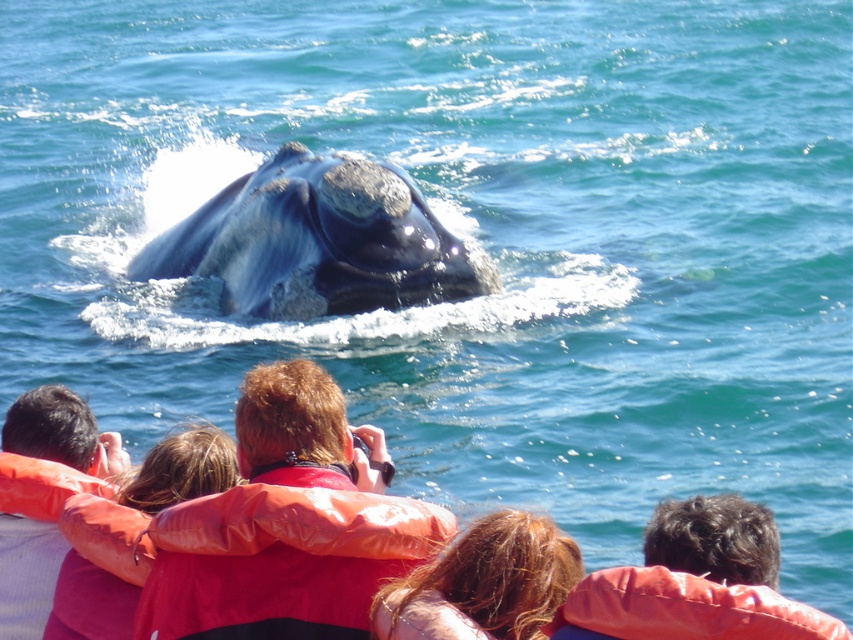
Is orange life vest at lower left thinner than orange life jacket at lower left?

No, orange life vest at lower left is not thinner than orange life jacket at lower left.

Is orange life vest at lower left behind orange life jacket at lower left?

Yes, orange life vest at lower left is behind orange life jacket at lower left.

The width and height of the screenshot is (853, 640). In order to click on orange life vest at lower left in this screenshot , I will do `click(44, 497)`.

Does red life vest at center have a lesser height compared to orange life jacket at lower left?

No.

Who is positioned more to the right, red life vest at center or orange life jacket at lower left?

orange life jacket at lower left is more to the right.

Where is `red life vest at center`? This screenshot has height=640, width=853. red life vest at center is located at coordinates (183, 468).

In the scene shown: Is gray matte whale at center wider than red life vest at center?

Yes.

Between gray matte whale at center and red life vest at center, which one is positioned lower?

Positioned lower is red life vest at center.

Is point (416, 200) positioned before point (222, 456)?

No.

This screenshot has height=640, width=853. Find the location of `gray matte whale at center`. gray matte whale at center is located at coordinates (316, 241).